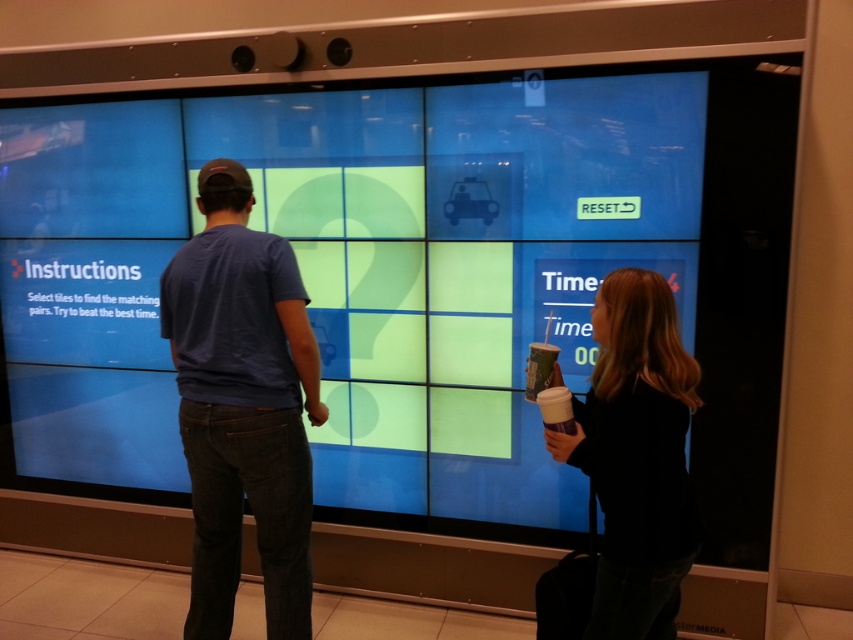
Question: Which of the following is the farthest from the observer?

Choices:
 (A) dark blue t-shirt at center
 (B) black matte hair at upper right

Answer: (A)

Question: Is dark blue t-shirt at center to the left of black matte hair at upper right from the viewer's perspective?

Choices:
 (A) no
 (B) yes

Answer: (B)

Question: Does dark blue t-shirt at center appear on the right side of black matte hair at upper right?

Choices:
 (A) no
 (B) yes

Answer: (A)

Question: Which point is farther to the camera?

Choices:
 (A) black matte hair at upper right
 (B) dark blue t-shirt at center

Answer: (B)

Question: Does dark blue t-shirt at center appear on the left side of black matte hair at upper right?

Choices:
 (A) no
 (B) yes

Answer: (B)